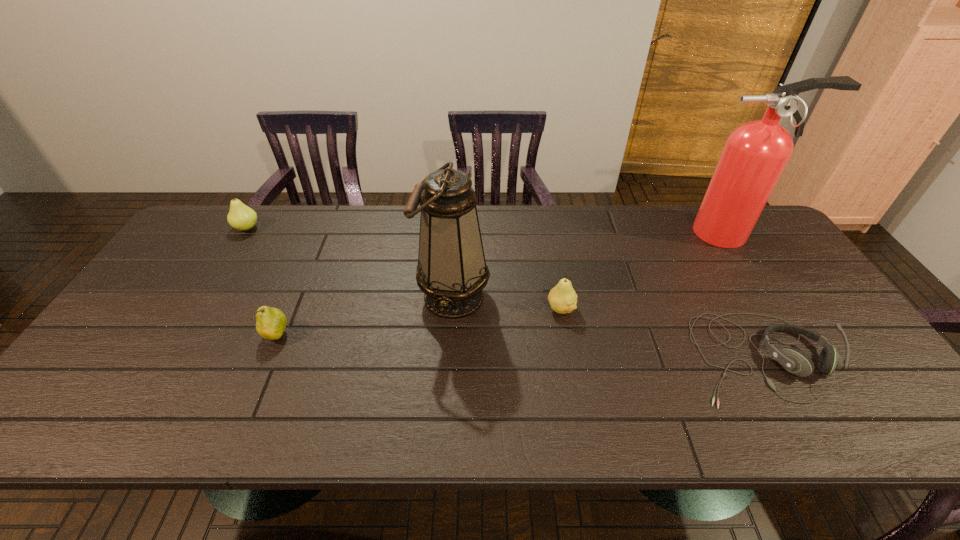
You are a GUI agent. You are given a task and a screenshot of the screen. Output one action in this format:
    pyautogui.click(x=<x>, y=<y>)
    Task: Click on the fire extinguisher
    The image size is (960, 540).
    Given the screenshot: What is the action you would take?
    pyautogui.click(x=755, y=154)

Locate an element on the screen. This screenshot has width=960, height=540. the third object from left to right is located at coordinates (452, 273).

Find the location of a particular element. the second tallest object is located at coordinates (452, 273).

Identify the location of the leftmost pear. This screenshot has height=540, width=960. (241, 217).

The image size is (960, 540). I want to click on the farthest pear, so click(x=241, y=217).

Where is `the rightmost pear`? This screenshot has height=540, width=960. the rightmost pear is located at coordinates (562, 298).

The height and width of the screenshot is (540, 960). I want to click on the fourth object from left to right, so click(x=562, y=298).

Where is `the second object from left to right`? This screenshot has width=960, height=540. the second object from left to right is located at coordinates [x=270, y=322].

Locate an element on the screen. The height and width of the screenshot is (540, 960). the nearest pear is located at coordinates (270, 322).

The image size is (960, 540). I want to click on headset, so tap(794, 361).